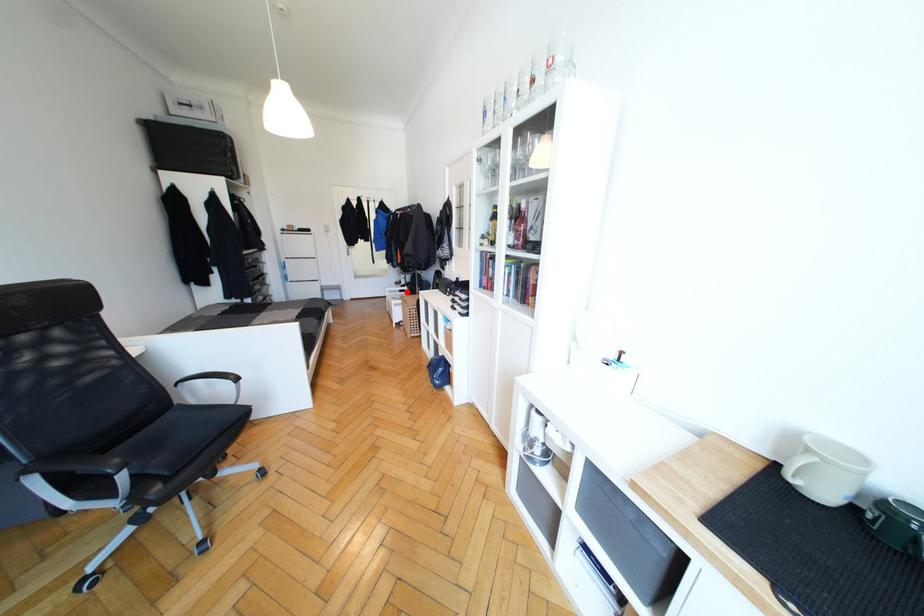
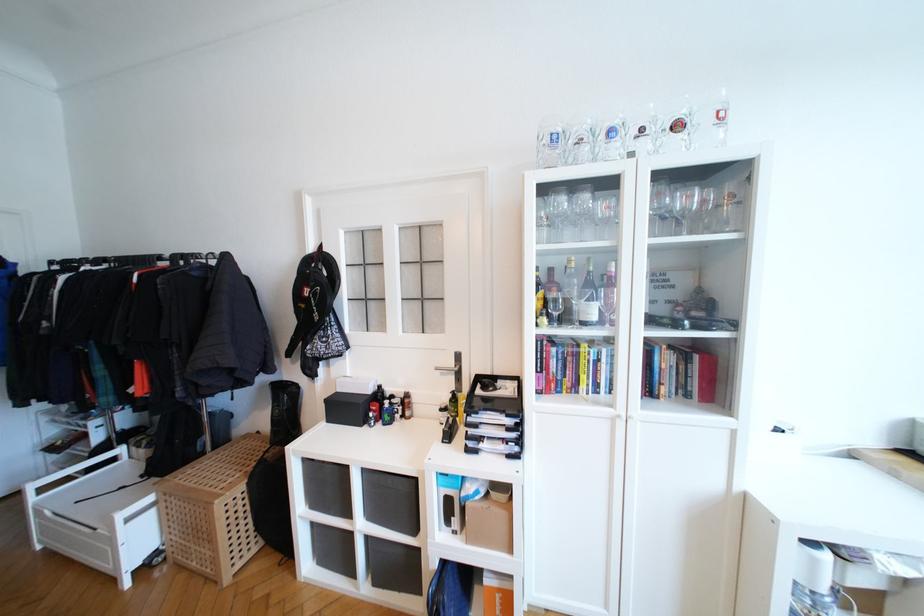
Question: A red point is marked in image1. In image2, is the corresponding 3D point closer to the camera or farther? Reply with the corresponding letter.

Choices:
 (A) The corresponding 3D point is closer.
 (B) The corresponding 3D point is farther.

Answer: (A)